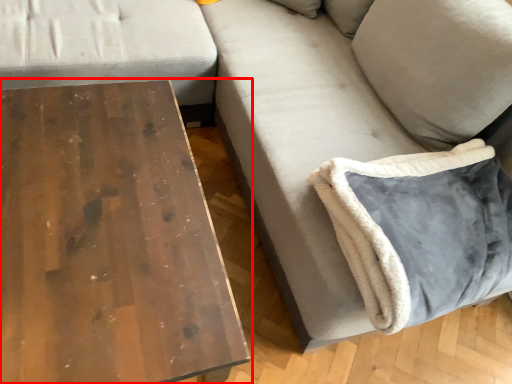
Question: Observing the image, what is the correct spatial positioning of table (annotated by the red box) in reference to pillow?

Choices:
 (A) right
 (B) left

Answer: (B)